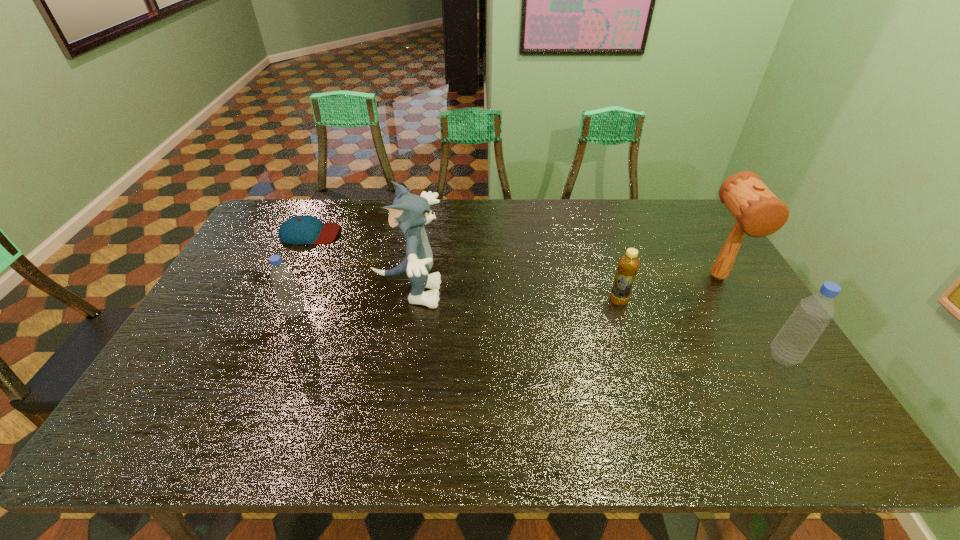
Locate an element on the screen. Image resolution: width=960 pixels, height=540 pixels. free space at the near edge of the desktop is located at coordinates (472, 404).

Locate an element on the screen. free location at the left edge is located at coordinates (252, 284).

Identify the location of free space at the right edge of the desktop. The height and width of the screenshot is (540, 960). (756, 360).

The image size is (960, 540). Find the location of `free point at the far left corner`. free point at the far left corner is located at coordinates (280, 210).

Where is `vacant area at the far right corner of the desktop`? This screenshot has width=960, height=540. vacant area at the far right corner of the desktop is located at coordinates (660, 225).

The height and width of the screenshot is (540, 960). Identify the location of empty space that is in between the cat and the baseball cap. (359, 263).

At what (x,y) coordinates should I click in order to perform the action: click on blank region between the tallest bottle and the leftmost bottle. Please return your answer as a coordinate pair (x, y). The width and height of the screenshot is (960, 540). Looking at the image, I should click on coord(540,334).

Where is `vacant space that is in between the nearest object and the farthest object`? The image size is (960, 540). vacant space that is in between the nearest object and the farthest object is located at coordinates (546, 295).

Locate an element on the screen. This screenshot has height=540, width=960. free area in between the mallet and the farthest object is located at coordinates (514, 255).

Image resolution: width=960 pixels, height=540 pixels. What are the coordinates of `free space that is in between the cat and the mallet` in the screenshot? It's located at (564, 285).